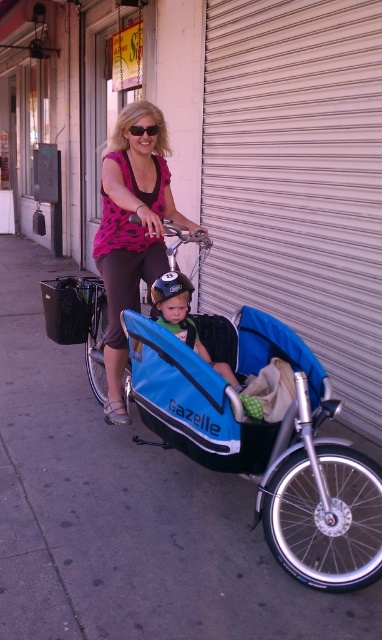
Question: Considering the relative positions of gray concrete sidewalk at center and matte pink shirt at center in the image provided, where is gray concrete sidewalk at center located with respect to matte pink shirt at center?

Choices:
 (A) right
 (B) left

Answer: (B)

Question: Estimate the real-world distances between objects in this image. Which object is farther from the blue fabric baby carriage at center?

Choices:
 (A) gray concrete sidewalk at center
 (B) black plastic sunglasses at upper center
 (C) matte blue helmet at center
 (D) matte pink shirt at center

Answer: (B)

Question: Does blue fabric baby carriage at center have a larger size compared to matte blue helmet at center?

Choices:
 (A) no
 (B) yes

Answer: (B)

Question: Based on their relative distances, which object is nearer to the matte blue helmet at center?

Choices:
 (A) blue fabric baby carriage at center
 (B) black plastic sunglasses at upper center

Answer: (A)

Question: Considering the relative positions of matte pink shirt at center and matte blue helmet at center in the image provided, where is matte pink shirt at center located with respect to matte blue helmet at center?

Choices:
 (A) left
 (B) right

Answer: (A)

Question: Which object is positioned farthest from the blue fabric baby carriage at center?

Choices:
 (A) black plastic sunglasses at upper center
 (B) matte blue helmet at center
 (C) matte pink shirt at center
 (D) gray concrete sidewalk at center

Answer: (A)